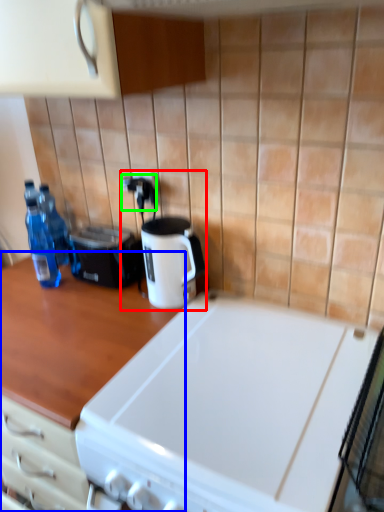
Question: Which object is the farthest from coffee machine (highlighted by a red box)? Choose among these: countertop (highlighted by a blue box) or electric outlet (highlighted by a green box).

Choices:
 (A) countertop
 (B) electric outlet

Answer: (A)